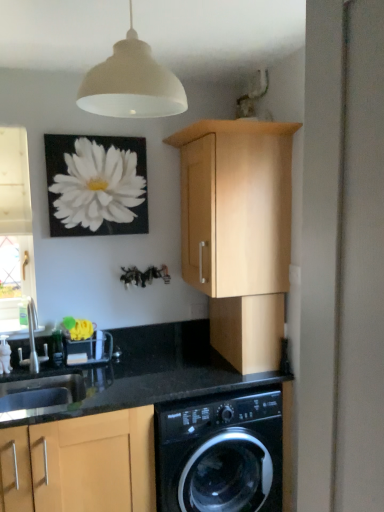
Question: Considering their positions, is silver metallic faucet at lower left located in front of or behind black glossy washing machine at lower center?

Choices:
 (A) behind
 (B) front

Answer: (A)

Question: Does point (36, 327) appear closer or farther from the camera than point (167, 475)?

Choices:
 (A) closer
 (B) farther

Answer: (B)

Question: Considering the real-world distances, which object is farthest from the clear glass window at left?

Choices:
 (A) light wood cabinet at upper center, acting as the 3th cabinetry starting from the bottom
 (B) silver metallic faucet at lower left
 (C) matte wood cabinet at center, which is the second cabinetry from bottom to top
 (D) black glossy washing machine at lower center
 (E) black granite sink at lower left

Answer: (D)

Question: Estimate the real-world distances between objects in this image. Which object is farther from the matte wood cabinet at center, which is the second cabinetry from bottom to top?

Choices:
 (A) matte wood cabinet at lower left, the 1th cabinetry from the bottom
 (B) black glossy washing machine at lower center
 (C) silver metallic faucet at lower left
 (D) white matte flower at upper left
 (E) clear glass window at left

Answer: (E)